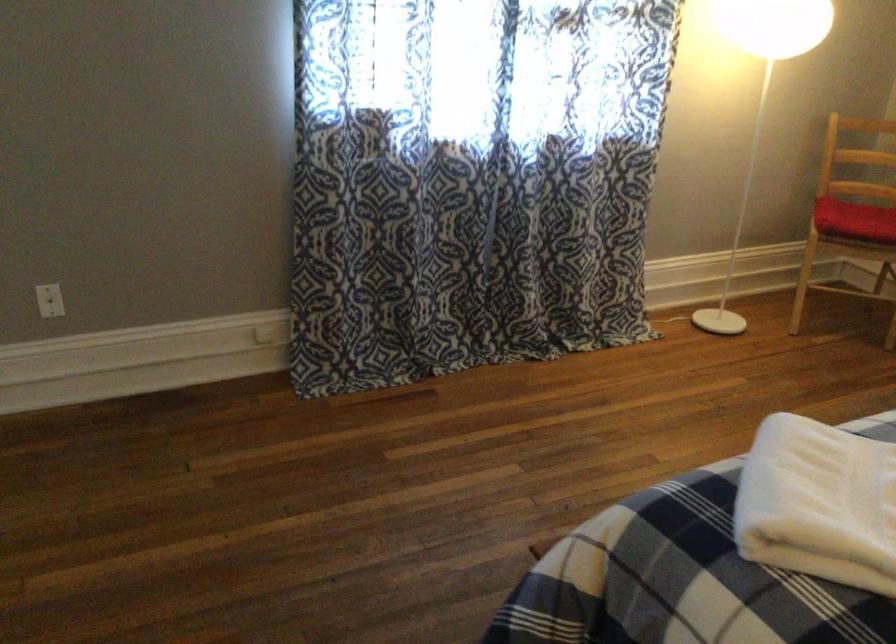
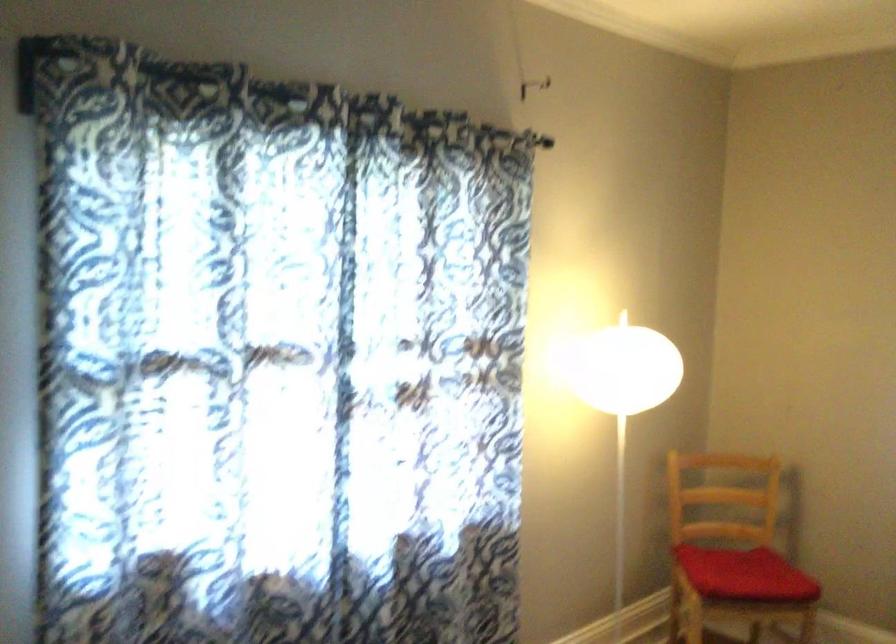
The first image is from the beginning of the video and the second image is from the end. How did the camera likely rotate when shooting the video?

The camera's rotation is toward right-up.